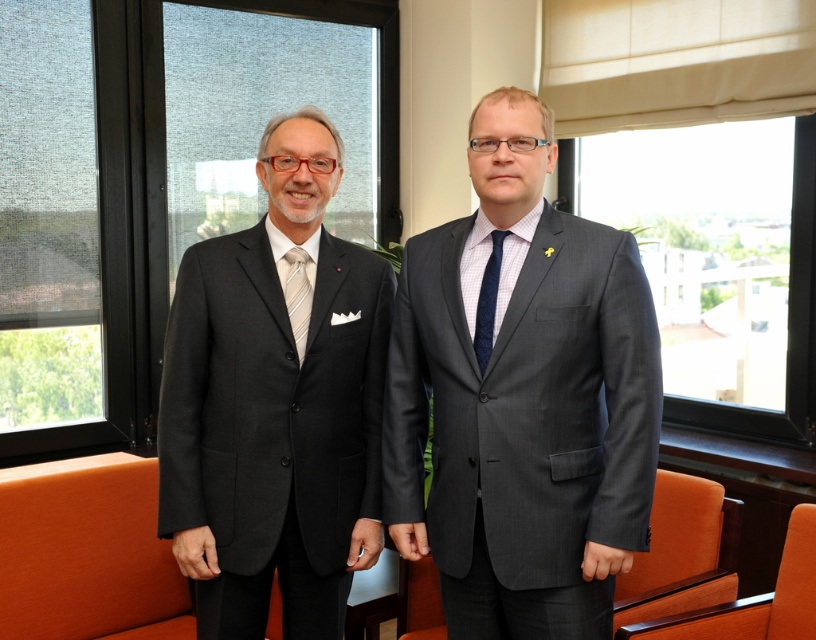
Question: Which object is farther from the camera taking this photo?

Choices:
 (A) matte black suit at center
 (B) matte black suit at left
 (C) transparent glass window at upper left
 (D) transparent glass window at left

Answer: (C)

Question: Is matte black suit at center thinner than gray textured suit at center?

Choices:
 (A) no
 (B) yes

Answer: (B)

Question: Estimate the real-world distances between objects in this image. Which object is farther from the dark blue textured tie at center?

Choices:
 (A) transparent glass window at upper left
 (B) gray textured suit at center

Answer: (A)

Question: From the image, what is the correct spatial relationship of matte black suit at center in relation to matte black suit at left?

Choices:
 (A) below
 (B) above

Answer: (B)

Question: Which object appears farthest from the camera in this image?

Choices:
 (A) matte black suit at left
 (B) transparent glass window at upper left
 (C) white striped tie at center

Answer: (B)

Question: Can you confirm if white striped tie at center is smaller than dark blue textured tie at center?

Choices:
 (A) yes
 (B) no

Answer: (A)